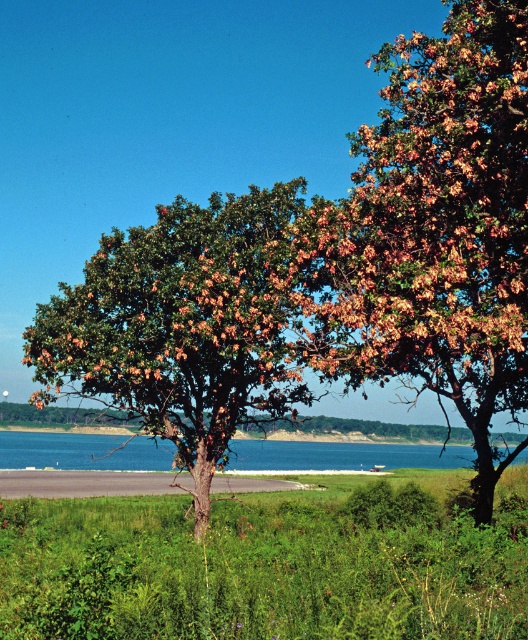
Question: Among these objects, which one is farthest from the camera?

Choices:
 (A) orange-brown textured tree at right
 (B) green leafy tree at center

Answer: (B)

Question: Estimate the real-world distances between objects in this image. Which object is farther from the green leafy tree at center?

Choices:
 (A) blue liquid water at center
 (B) orange-brown textured tree at right
 (C) gray asphalt at lower center

Answer: (A)

Question: Does blue liquid water at center have a greater width compared to gray asphalt at lower center?

Choices:
 (A) yes
 (B) no

Answer: (A)

Question: Is orange-brown textured tree at right above blue liquid water at center?

Choices:
 (A) yes
 (B) no

Answer: (A)

Question: Can you confirm if green leafy tree at center is positioned to the left of gray asphalt at lower center?

Choices:
 (A) no
 (B) yes

Answer: (A)

Question: Among these objects, which one is nearest to the camera?

Choices:
 (A) orange-brown textured tree at right
 (B) green leafy tree at center
 (C) gray asphalt at lower center
 (D) blue liquid water at center

Answer: (A)